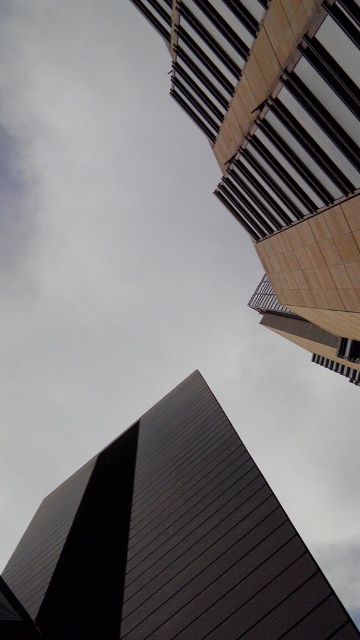
Question: Does dark gray metallic tower at lower center appear on the left side of smooth beige building at upper right?

Choices:
 (A) no
 (B) yes

Answer: (B)

Question: Is dark gray metallic tower at lower center wider than smooth beige building at upper right?

Choices:
 (A) no
 (B) yes

Answer: (A)

Question: Is dark gray metallic tower at lower center to the left of smooth beige building at upper right from the viewer's perspective?

Choices:
 (A) no
 (B) yes

Answer: (B)

Question: Which point appears farthest from the camera in this image?

Choices:
 (A) (236, 572)
 (B) (249, 152)

Answer: (B)

Question: Which point is closer to the camera?

Choices:
 (A) (340, 106)
 (B) (288, 630)

Answer: (B)

Question: Which point is farther to the camera?

Choices:
 (A) smooth beige building at upper right
 (B) dark gray metallic tower at lower center

Answer: (A)